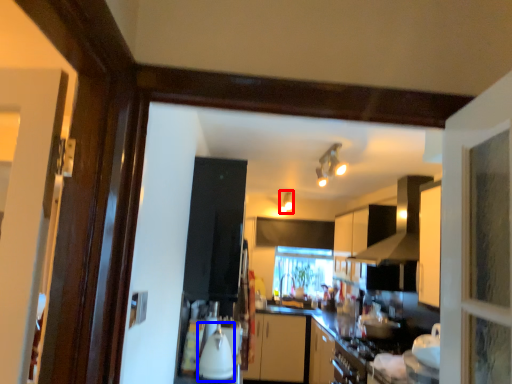
Question: Which object appears closest to the camera in this image, light fixture (highlighted by a red box) or appliance (highlighted by a blue box)?

Choices:
 (A) light fixture
 (B) appliance

Answer: (B)